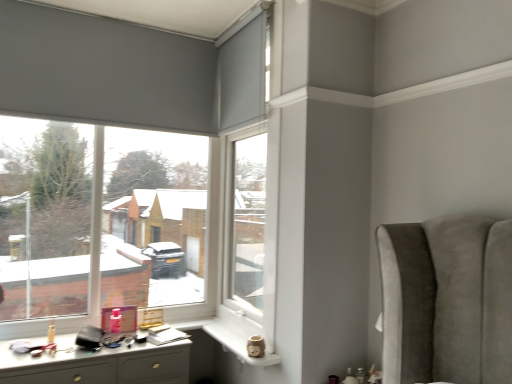
Question: Which is correct: matte gray roller blind at left is inside white plastic window frame at center, or outside of it?

Choices:
 (A) inside
 (B) outside

Answer: (B)

Question: Looking at the image, does matte gray roller blind at left seem bigger or smaller compared to white plastic window frame at center?

Choices:
 (A) big
 (B) small

Answer: (A)

Question: Which object is positioned farthest from the white ceramic mug at lower center?

Choices:
 (A) matte gray roller blind at left
 (B) white glossy desk at lower left
 (C) white plastic window frame at center

Answer: (A)

Question: Considering the real-world distances, which object is closest to the matte gray roller blind at left?

Choices:
 (A) white glossy desk at lower left
 (B) white plastic window frame at center
 (C) white ceramic mug at lower center

Answer: (B)